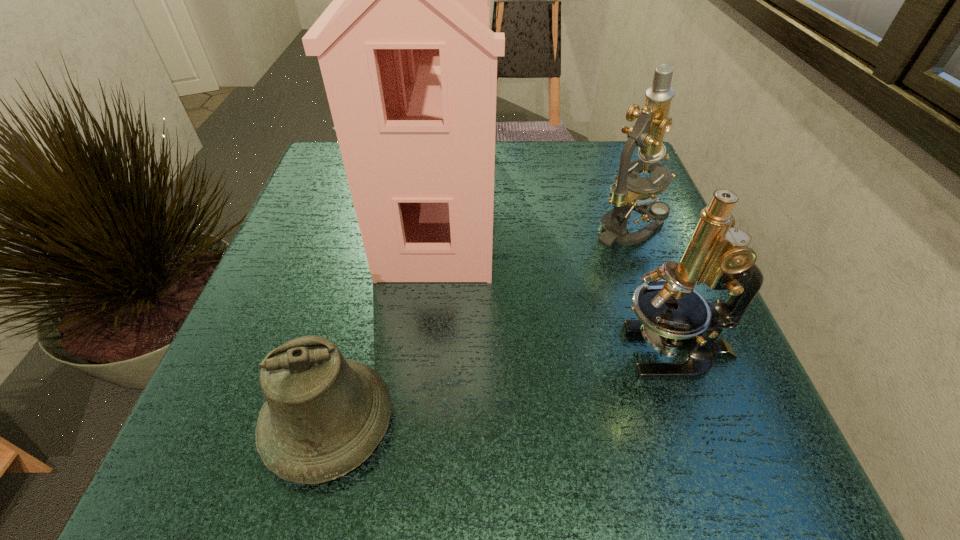
Select which object is the closest to the farther microscope. Please provide its 2D coordinates. Your answer should be formatted as a tuple, i.e. [(x, y)], where the tuple contains the x and y coordinates of a point satisfying the conditions above.

[(671, 314)]

The width and height of the screenshot is (960, 540). What are the coordinates of `the third closest object relative to the tallest object` in the screenshot? It's located at (630, 193).

The image size is (960, 540). In order to click on vacant space that satisfies the following two spatial constraints: 1. on the front-facing side of the farther microscope; 2. on the left side of the dollhouse in this screenshot , I will do `click(437, 226)`.

You are a GUI agent. You are given a task and a screenshot of the screen. Output one action in this format:
    pyautogui.click(x=<x>, y=<y>)
    Task: Click on the vacant point that satisfies the following two spatial constraints: 1. on the back side of the farther microscope; 2. on the front-facing side of the tallest object
    
    Given the screenshot: What is the action you would take?
    pyautogui.click(x=619, y=201)